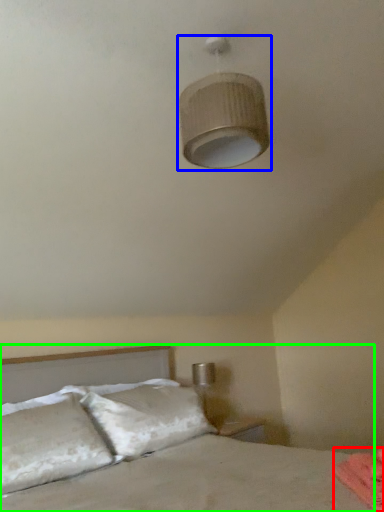
Question: Based on their relative distances, which object is farther from sheet (highlighted by a red box)? Choose from lamp (highlighted by a blue box) and bed (highlighted by a green box).

Choices:
 (A) lamp
 (B) bed

Answer: (A)